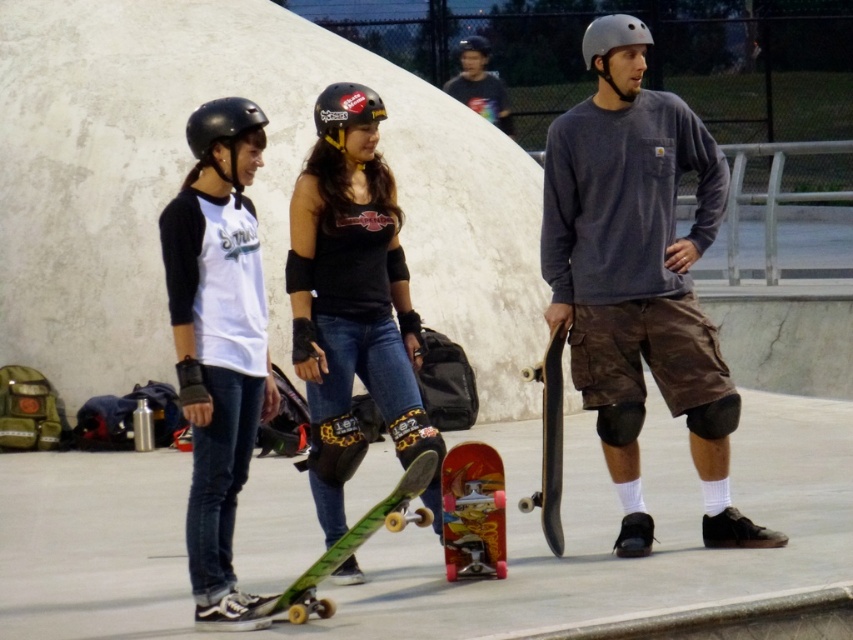
Question: From the image, what is the correct spatial relationship of matte gray helmet at center in relation to matte black helmet at center?

Choices:
 (A) left
 (B) right

Answer: (B)

Question: Which of the following is the closest to the observer?

Choices:
 (A) (631, 371)
 (B) (612, 28)

Answer: (B)

Question: Among these points, which one is farthest from the camera?

Choices:
 (A) (639, 108)
 (B) (292, 618)
 (C) (363, 104)
 (D) (189, 177)

Answer: (A)

Question: Does matte gray helmet at center have a smaller size compared to white matte t-shirt at center?

Choices:
 (A) yes
 (B) no

Answer: (B)

Question: Can you confirm if matte black skateboard at center is thinner than matte black helmet at center?

Choices:
 (A) no
 (B) yes

Answer: (A)

Question: Which of the following is the closest to the observer?

Choices:
 (A) matte black helmet at left
 (B) red glossy skateboard at center

Answer: (A)